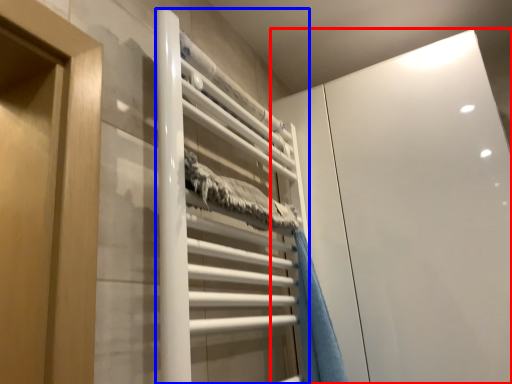
Question: Which of the following is the closest to the observer, glass door (highlighted by a red box) or stair (highlighted by a blue box)?

Choices:
 (A) glass door
 (B) stair

Answer: (B)